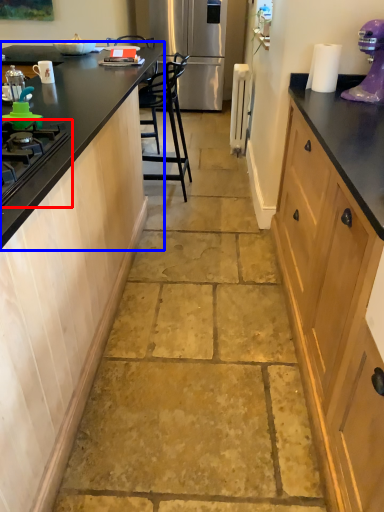
Question: Which object appears closest to the camera in this image, gas stove (highlighted by a red box) or countertop (highlighted by a blue box)?

Choices:
 (A) gas stove
 (B) countertop

Answer: (A)